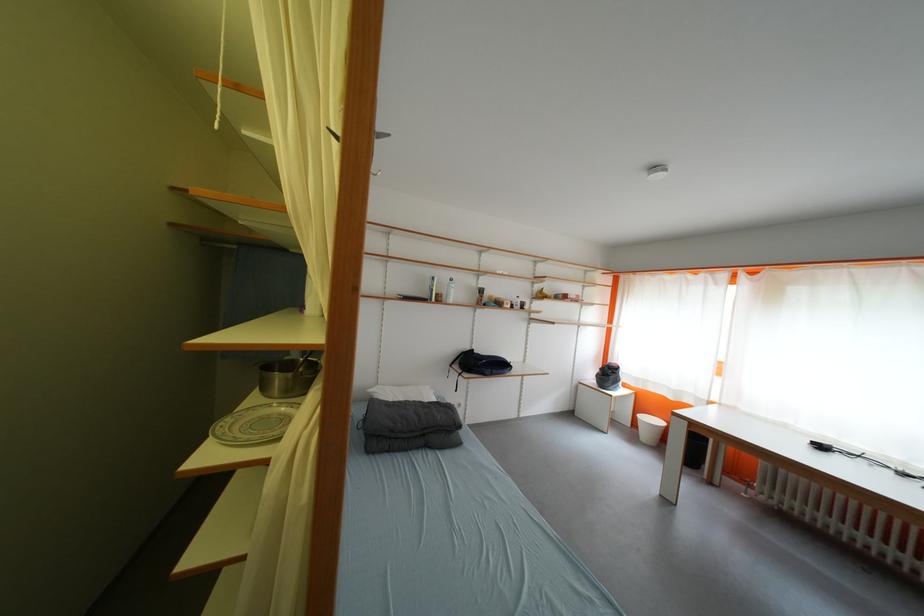
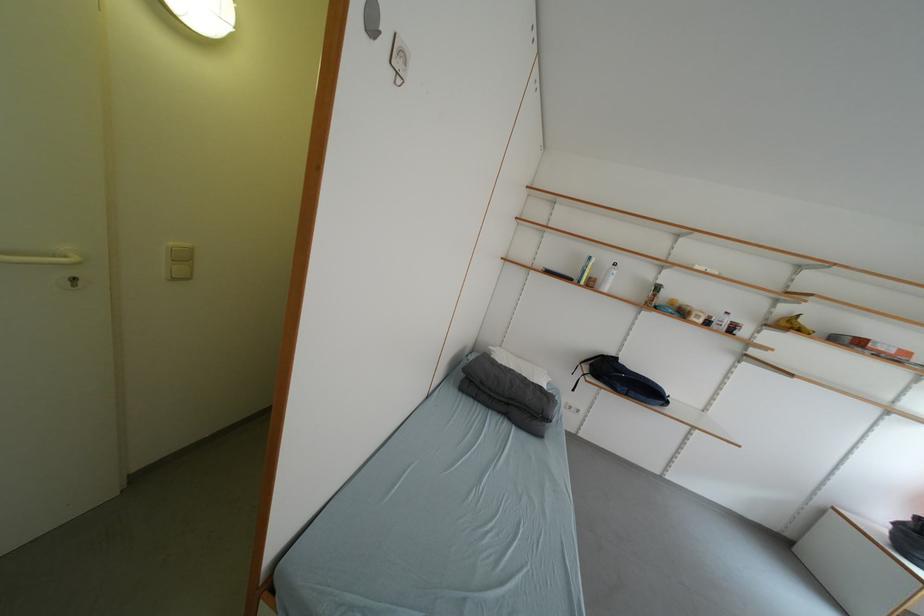
The point at (503, 374) is marked in the first image. Where is the corresponding point in the second image?

(640, 395)